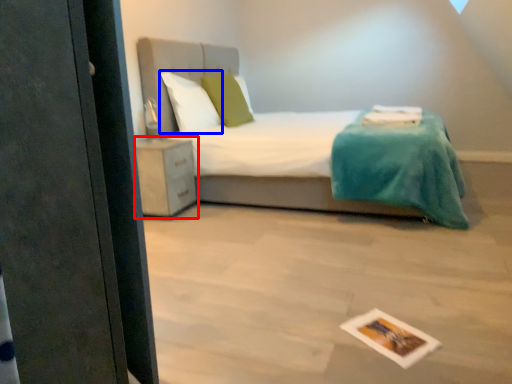
Question: Which object appears farthest to the camera in this image, nightstand (highlighted by a red box) or pillow (highlighted by a blue box)?

Choices:
 (A) nightstand
 (B) pillow

Answer: (B)